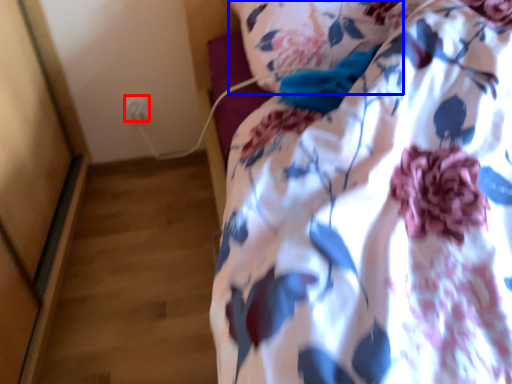
Question: Among these objects, which one is nearest to the camera, electric outlet (highlighted by a red box) or pillow (highlighted by a blue box)?

Choices:
 (A) electric outlet
 (B) pillow

Answer: (B)